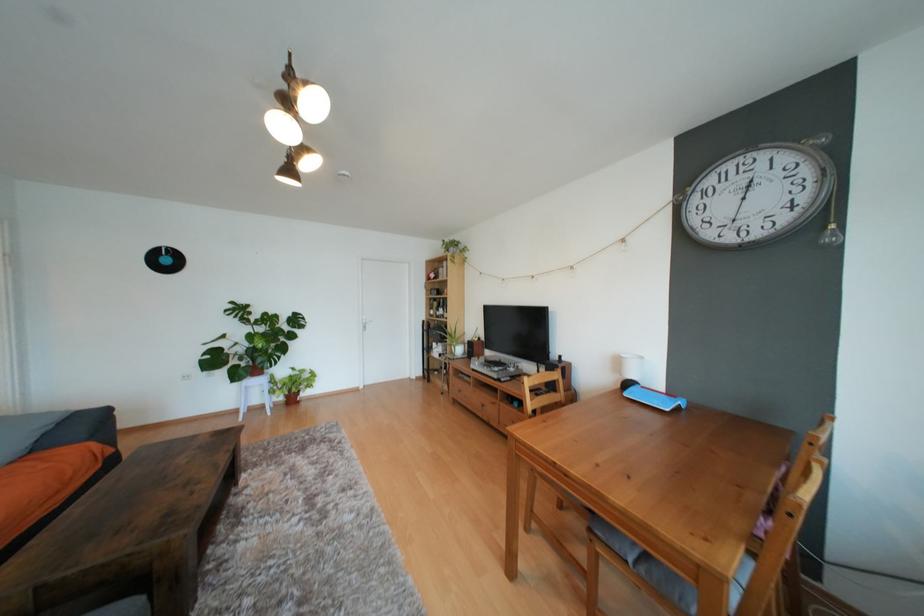
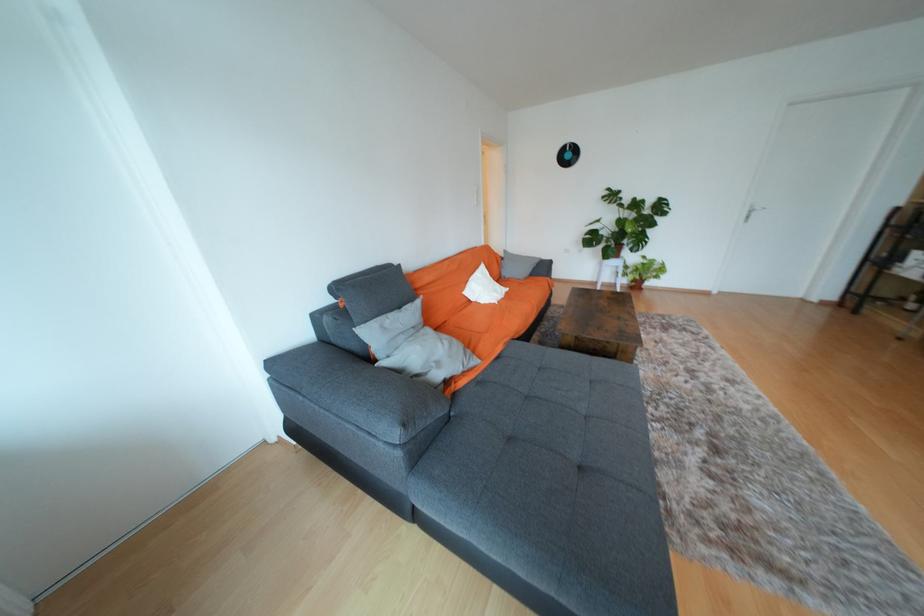
The first image is from the beginning of the video and the second image is from the end. How did the camera likely rotate when shooting the video?

The camera rotated toward left-down.